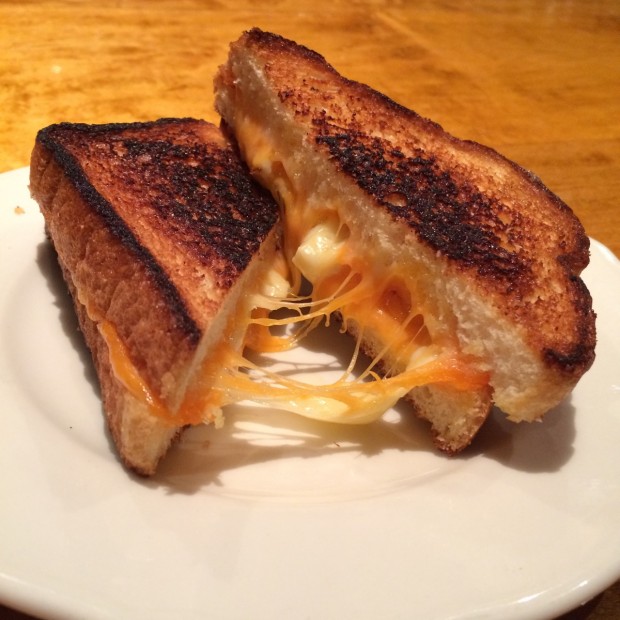
Locate an element on the screen. Image resolution: width=620 pixels, height=620 pixels. table wooden on stains is located at coordinates (77, 46).